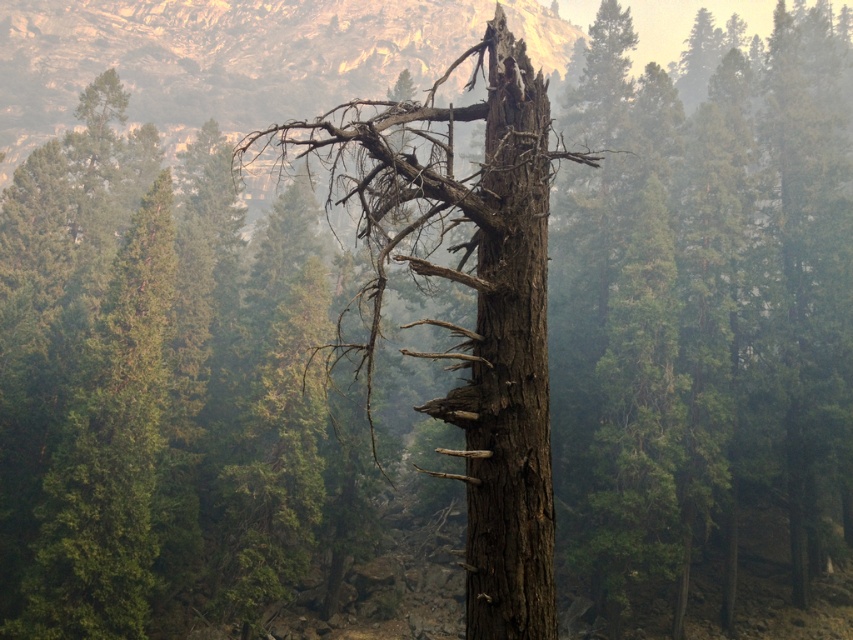
You are an ecologist studying the forest structure. You notice a specific point in the forest at coordinates point (x=476, y=301). Based on the scene description, what object does this coordinate correspond to?

The point (x=476, y=301) corresponds to the brown rough bark tree at center.

You are a hiker who wants to climb the tallest tree in the forest. You see the brown rough bark tree at center and the dark brown rough bark tree trunk at center. Which one should you choose to climb?

The brown rough bark tree at center is much taller than the dark brown rough bark tree trunk at center, so you should choose to climb the brown rough bark tree at center.